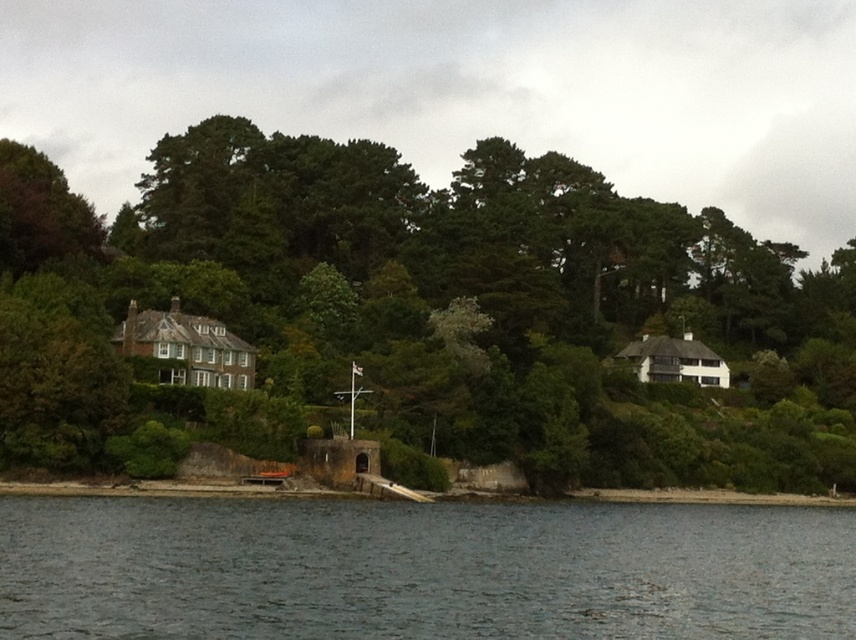
Question: Is green leafy tree at center to the left of dark blue water at lower center from the viewer's perspective?

Choices:
 (A) no
 (B) yes

Answer: (A)

Question: Which point is closer to the camera taking this photo?

Choices:
 (A) (679, 605)
 (B) (535, 452)

Answer: (A)

Question: Where is green leafy tree at center located in relation to dark blue water at lower center in the image?

Choices:
 (A) below
 (B) above

Answer: (B)

Question: Is green leafy tree at center wider than dark blue water at lower center?

Choices:
 (A) no
 (B) yes

Answer: (B)